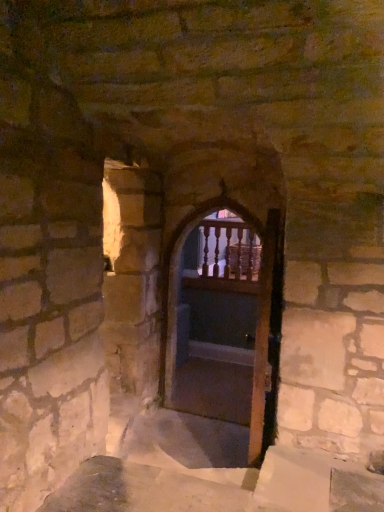
Question: Is wooden screen door at center a part of wooden at center?

Choices:
 (A) no
 (B) yes

Answer: (A)

Question: From a real-world perspective, is wooden at center positioned over wooden screen door at center based on gravity?

Choices:
 (A) yes
 (B) no

Answer: (A)

Question: Does wooden at center have a smaller size compared to wooden screen door at center?

Choices:
 (A) yes
 (B) no

Answer: (B)

Question: From a real-world perspective, is wooden at center beneath wooden screen door at center?

Choices:
 (A) yes
 (B) no

Answer: (B)

Question: Considering the relative sizes of wooden at center and wooden screen door at center in the image provided, is wooden at center shorter than wooden screen door at center?

Choices:
 (A) yes
 (B) no

Answer: (B)

Question: Is wooden at center bigger or smaller than wooden screen door at center?

Choices:
 (A) small
 (B) big

Answer: (B)

Question: Looking at their shapes, would you say wooden at center is wider or thinner than wooden screen door at center?

Choices:
 (A) thin
 (B) wide

Answer: (B)

Question: From the image's perspective, is wooden at center above or below wooden screen door at center?

Choices:
 (A) below
 (B) above

Answer: (B)

Question: Relative to wooden screen door at center, is wooden at center in front or behind?

Choices:
 (A) front
 (B) behind

Answer: (B)

Question: Do you think wooden balusters at center is within wooden at center, or outside of it?

Choices:
 (A) outside
 (B) inside

Answer: (A)

Question: Considering the positions of wooden balusters at center and wooden at center in the image, is wooden balusters at center taller or shorter than wooden at center?

Choices:
 (A) short
 (B) tall

Answer: (A)

Question: In the image, is wooden balusters at center on the left side or the right side of wooden at center?

Choices:
 (A) left
 (B) right

Answer: (B)

Question: From the image's perspective, relative to wooden at center, is wooden balusters at center above or below?

Choices:
 (A) above
 (B) below

Answer: (A)

Question: Relative to wooden at center, is wooden screen door at center in front or behind?

Choices:
 (A) front
 (B) behind

Answer: (A)

Question: In terms of size, does wooden screen door at center appear bigger or smaller than wooden at center?

Choices:
 (A) small
 (B) big

Answer: (A)